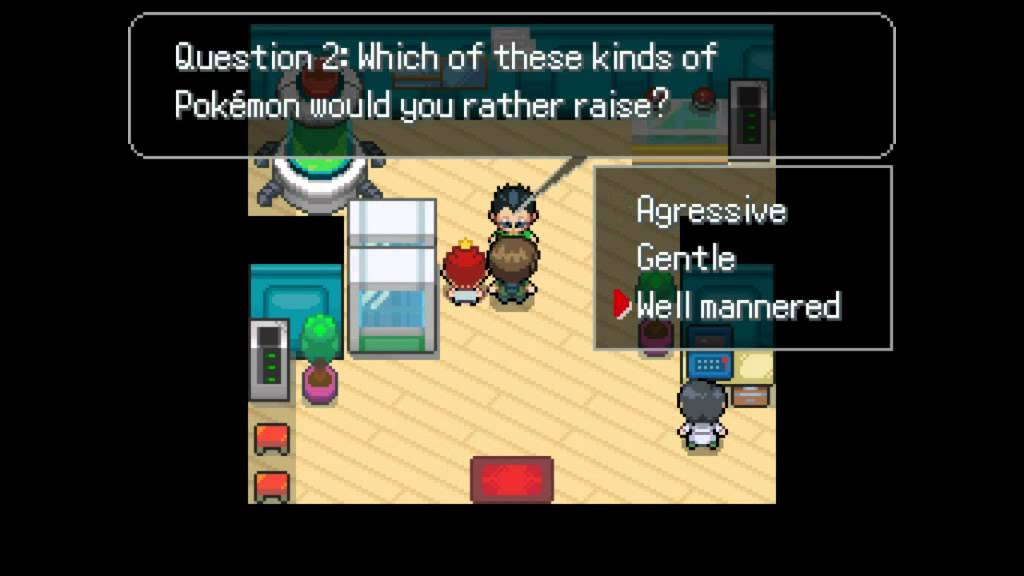
Image resolution: width=1024 pixels, height=576 pixels. In order to click on floor in this screenshot , I will do `click(521, 412)`.